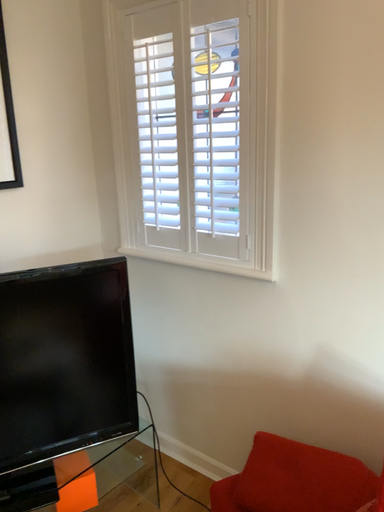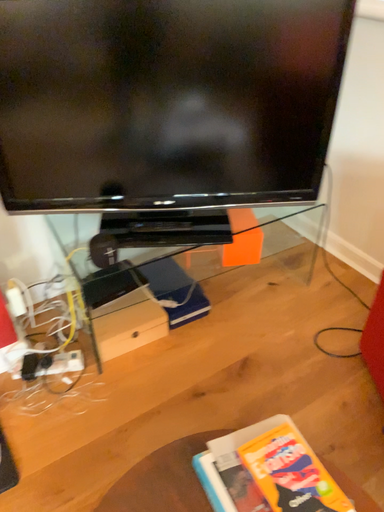
Question: Which way did the camera rotate in the video?

Choices:
 (A) rotated left
 (B) rotated right

Answer: (A)